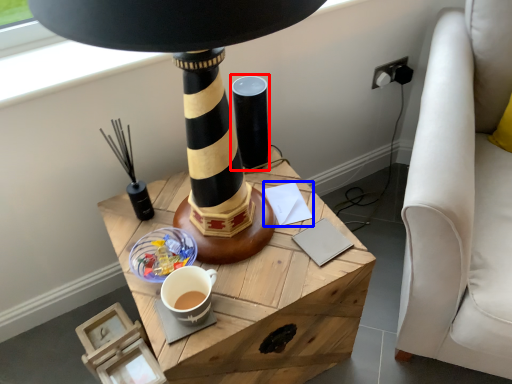
Question: Which object is further to the camera taking this photo, candle holder (highlighted by a red box) or notepad (highlighted by a blue box)?

Choices:
 (A) candle holder
 (B) notepad

Answer: (B)